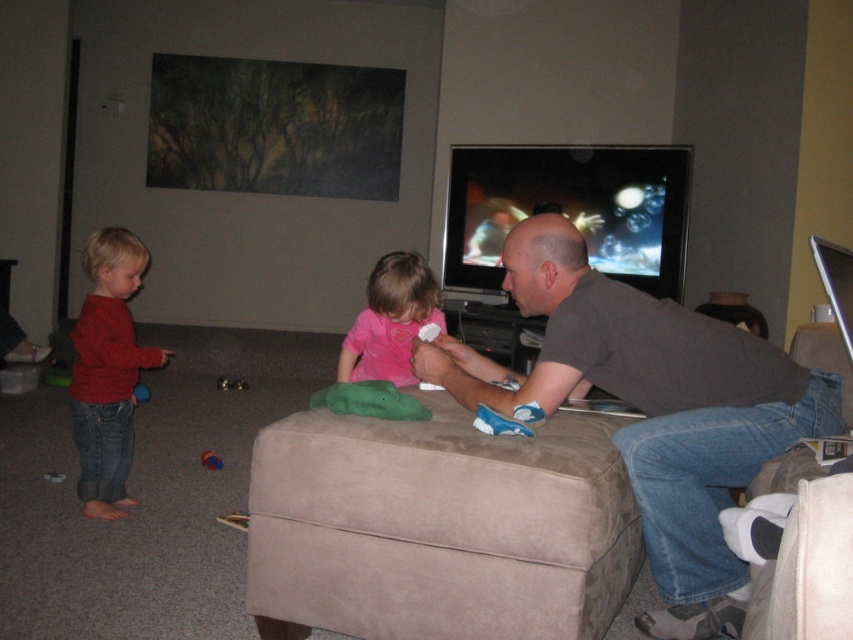
Question: Considering the real-world distances, which object is closest to the dark gray shirt at center?

Choices:
 (A) matte red sweater at left
 (B) pink matte shirt at center

Answer: (B)

Question: Can you confirm if pink matte shirt at center is wider than rubberized red ball at lower left?

Choices:
 (A) no
 (B) yes

Answer: (B)

Question: Which point is farther to the camera?

Choices:
 (A) (689, 630)
 (B) (128, 241)
 (C) (219, 458)

Answer: (C)

Question: Does matte red sweater at left appear under pink matte shirt at center?

Choices:
 (A) no
 (B) yes

Answer: (B)

Question: Is the position of dark gray shirt at center more distant than that of matte red sweater at left?

Choices:
 (A) no
 (B) yes

Answer: (A)

Question: Estimate the real-world distances between objects in this image. Which object is farther from the pink matte shirt at center?

Choices:
 (A) matte red sweater at left
 (B) dark gray shirt at center

Answer: (A)